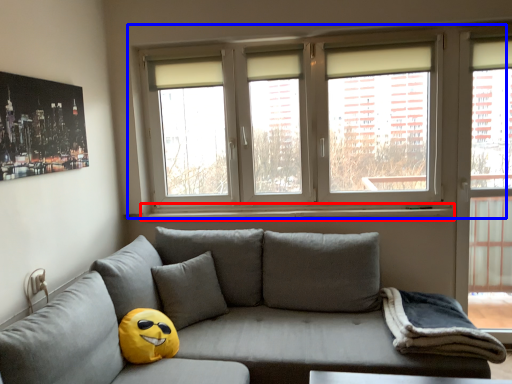
Question: Among these objects, which one is nearest to the camera, window sill (highlighted by a red box) or window (highlighted by a blue box)?

Choices:
 (A) window sill
 (B) window

Answer: (B)